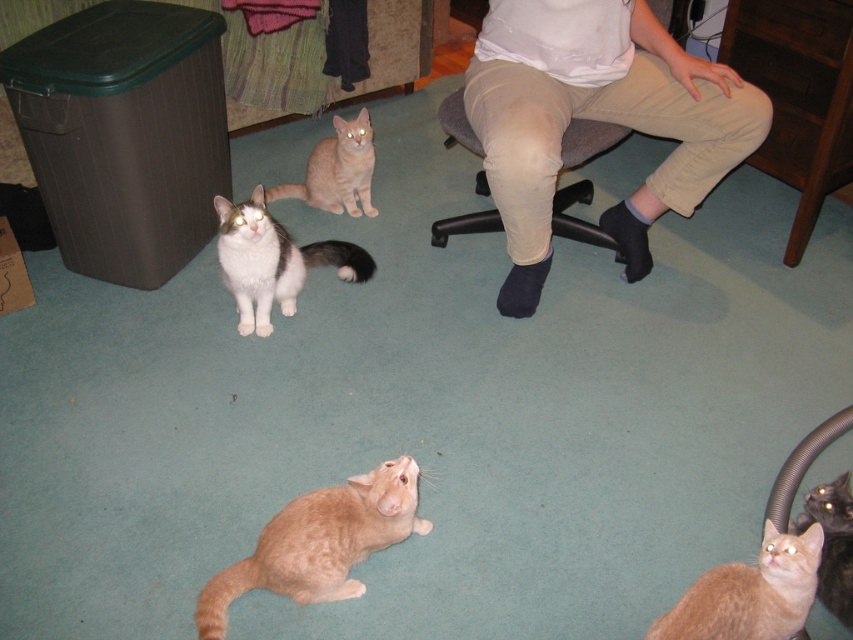
Question: Which point is closer to the camera?

Choices:
 (A) light beige pants at center
 (B) orange fur cat at lower right
 (C) white-furred cat with black markings at left

Answer: (B)

Question: Estimate the real-world distances between objects in this image. Which object is closer to the fluffy orange cat at lower right?

Choices:
 (A) white-furred cat with black markings at left
 (B) light beige pants at center

Answer: (B)

Question: Is orange fur cat at lower right further to the viewer compared to orange fur cat at upper center?

Choices:
 (A) yes
 (B) no

Answer: (B)

Question: Where is light beige pants at center located in relation to fuzzy orange cat at lower center in the image?

Choices:
 (A) above
 (B) below

Answer: (A)

Question: Which point appears farthest from the camera in this image?

Choices:
 (A) (645, 100)
 (B) (849, 580)
 (C) (476, 228)

Answer: (C)

Question: Is fuzzy orange cat at lower center to the left of fluffy orange cat at lower right from the viewer's perspective?

Choices:
 (A) yes
 (B) no

Answer: (A)